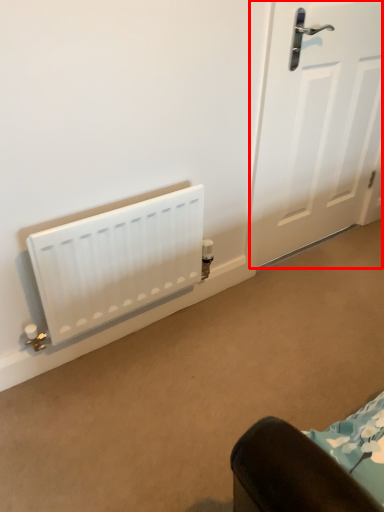
Question: From the image, what is the correct spatial relationship of door (annotated by the red box) in relation to radiator?

Choices:
 (A) right
 (B) left

Answer: (A)